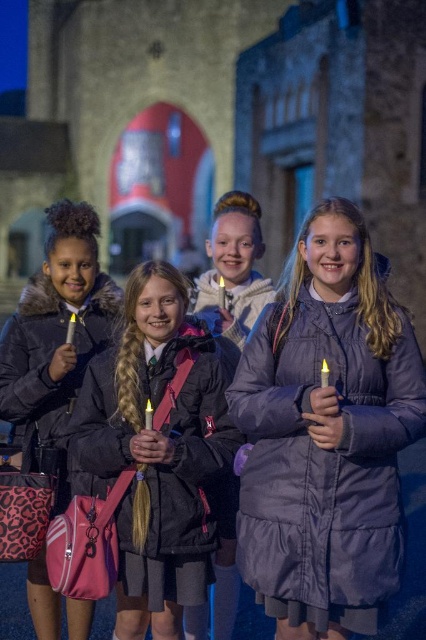
Who is positioned more to the left, black matte jacket at center or matte purple coat at center?

black matte jacket at center is more to the left.

Is black matte jacket at center thinner than matte purple coat at center?

No.

Who is more distant from viewer, (180, 348) or (219, 248)?

The point (219, 248) is behind.

The width and height of the screenshot is (426, 640). In order to click on black matte jacket at center in this screenshot , I will do `click(158, 451)`.

Who is more forward, (244, 520) or (245, 250)?

Point (244, 520)

Is purple puffy coat at center thinner than matte purple coat at center?

In fact, purple puffy coat at center might be wider than matte purple coat at center.

Between point (285, 401) and point (265, 301), which one is positioned behind?

The point (265, 301) is behind.

The height and width of the screenshot is (640, 426). I want to click on purple puffy coat at center, so click(325, 435).

Is purple puffy coat at center bigger than black matte jacket at center?

Indeed, purple puffy coat at center has a larger size compared to black matte jacket at center.

Is point (379, 509) positioned before point (129, 540)?

Yes, point (379, 509) is in front of point (129, 540).

Find the location of a particular element. purple puffy coat at center is located at coordinates (325, 435).